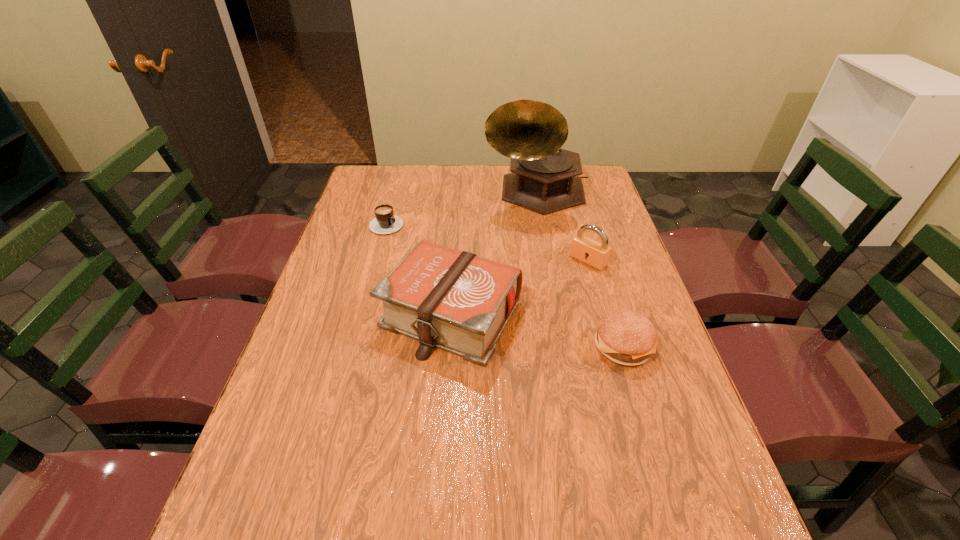
You are a GUI agent. You are given a task and a screenshot of the screen. Output one action in this format:
    pyautogui.click(x=<x>, y=<y>)
    Task: Click on the Bible
    
    Given the screenshot: What is the action you would take?
    pyautogui.click(x=457, y=301)

At what (x,y) coordinates should I click in order to perform the action: click on the fourth tallest object. Please return your answer as a coordinate pair (x, y). Image resolution: width=960 pixels, height=540 pixels. Looking at the image, I should click on (625, 337).

Identify the location of the tallest object. This screenshot has height=540, width=960. (545, 179).

The image size is (960, 540). I want to click on padlock, so click(x=596, y=254).

Locate an element on the screen. the shortest object is located at coordinates (386, 222).

At what (x,y) coordinates should I click in order to perform the action: click on free location located 0.100m on the right of the Bible. Please return your answer as a coordinate pair (x, y). The height and width of the screenshot is (540, 960). Looking at the image, I should click on (561, 313).

Locate an element on the screen. Image resolution: width=960 pixels, height=540 pixels. vacant position located on the left of the fourth tallest object is located at coordinates (471, 346).

In order to click on blank space located 0.260m on the horn direction of the tallest object in this screenshot , I will do pos(538,274).

Identify the location of free space located on the horn direction of the tallest object. This screenshot has width=960, height=540. (538, 288).

Locate an element on the screen. blank area located 0.340m on the horn direction of the tallest object is located at coordinates (538, 293).